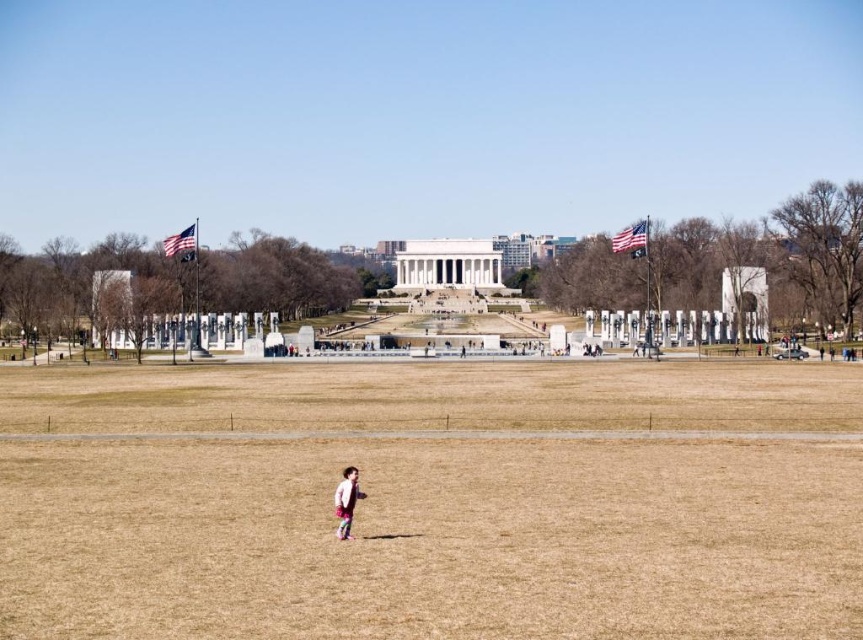
You are a photographer positioned at the point labeled as point (432, 500). You want to capture a photo of the brown grass at center. Is the point you are standing at the correct location to take the photo?

Yes, the point (432, 500) corresponds to the brown grass at center, so standing at that point would allow you to take the photo.

You are a photographer trying to capture a shot of the pink fabric child at center and the brown grass at center in the image. Based on their positions, which object would appear closer to the camera in the photo?

The brown grass at center appears closer to the camera because it is located above the pink fabric child at center in the scene.